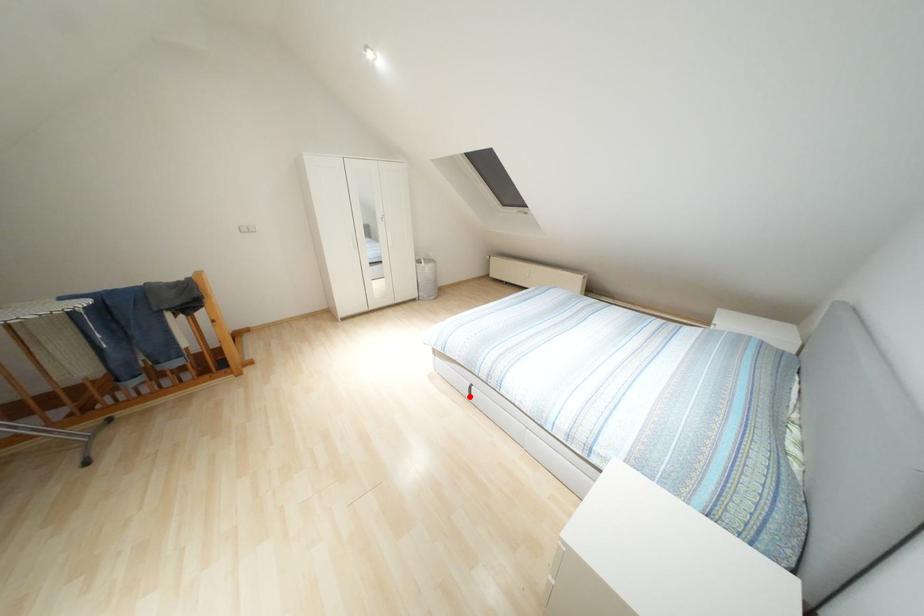
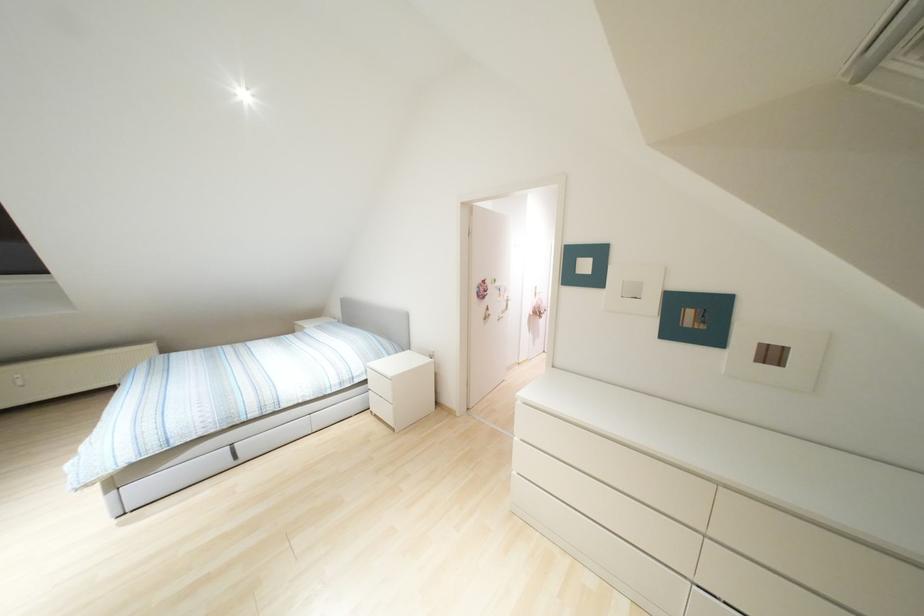
Locate, in the second image, the point that corresponds to the highlighted location in the first image.

(235, 456)